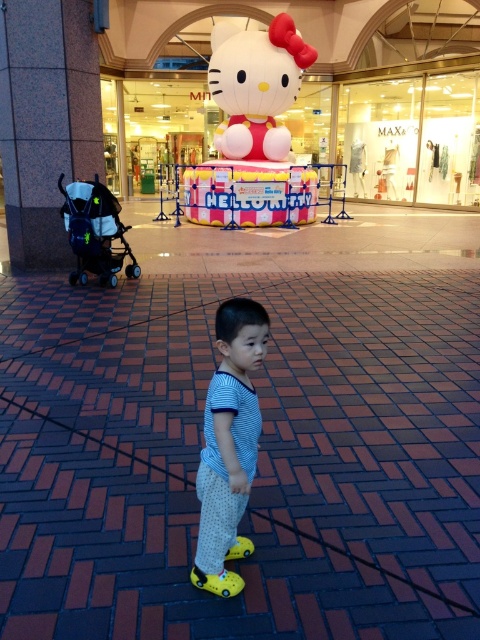
Looking at this image, between marble pillar at left and white matte hello kitty at upper center, which one is positioned higher?

white matte hello kitty at upper center is higher up.

Does marble pillar at left have a greater width compared to white matte hello kitty at upper center?

In fact, marble pillar at left might be narrower than white matte hello kitty at upper center.

Which is behind, point (35, 115) or point (216, 92)?

Positioned behind is point (216, 92).

Find the location of a particular element. The height and width of the screenshot is (640, 480). marble pillar at left is located at coordinates (46, 120).

Which of these two, striped fabric shirt at center or black matte baby carriage at left, stands taller?

black matte baby carriage at left is taller.

Does striped fabric shirt at center have a smaller size compared to black matte baby carriage at left?

Yes.

Between point (250, 484) and point (84, 220), which one is positioned behind?

The point (84, 220) is more distant.

Locate an element on the screen. Image resolution: width=480 pixels, height=640 pixels. striped fabric shirt at center is located at coordinates (228, 444).

Based on the photo, who is positioned more to the left, white matte hello kitty at upper center or black matte baby carriage at left?

black matte baby carriage at left is more to the left.

Is the position of white matte hello kitty at upper center more distant than that of black matte baby carriage at left?

Yes.

Does point (279, 13) come behind point (108, 221)?

Yes, point (279, 13) is behind point (108, 221).

Where is `white matte hello kitty at upper center`? This screenshot has height=640, width=480. white matte hello kitty at upper center is located at coordinates (249, 122).